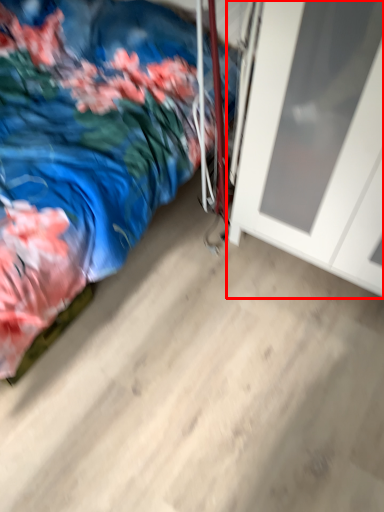
Question: From the image, what is the correct spatial relationship of door (annotated by the red box) in relation to bed?

Choices:
 (A) right
 (B) left

Answer: (A)